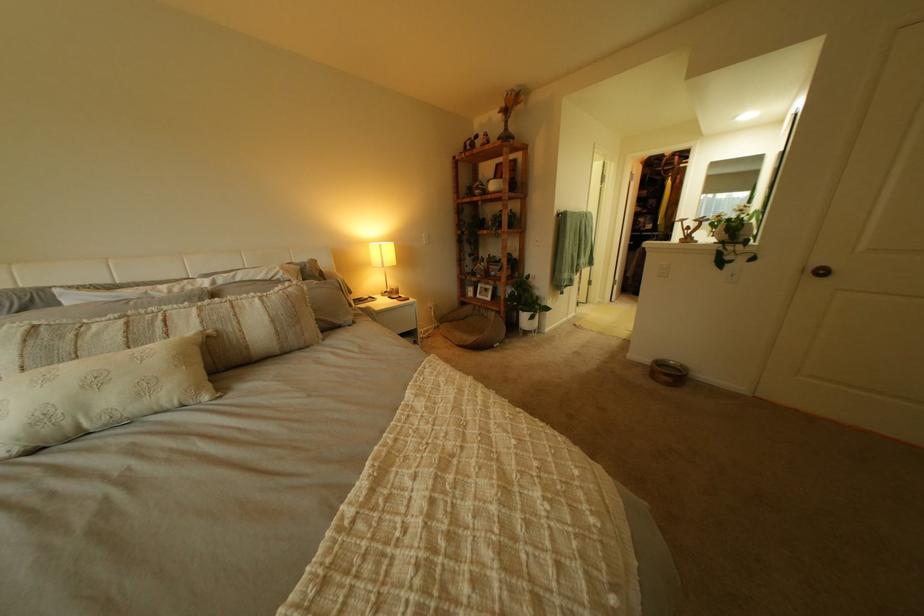
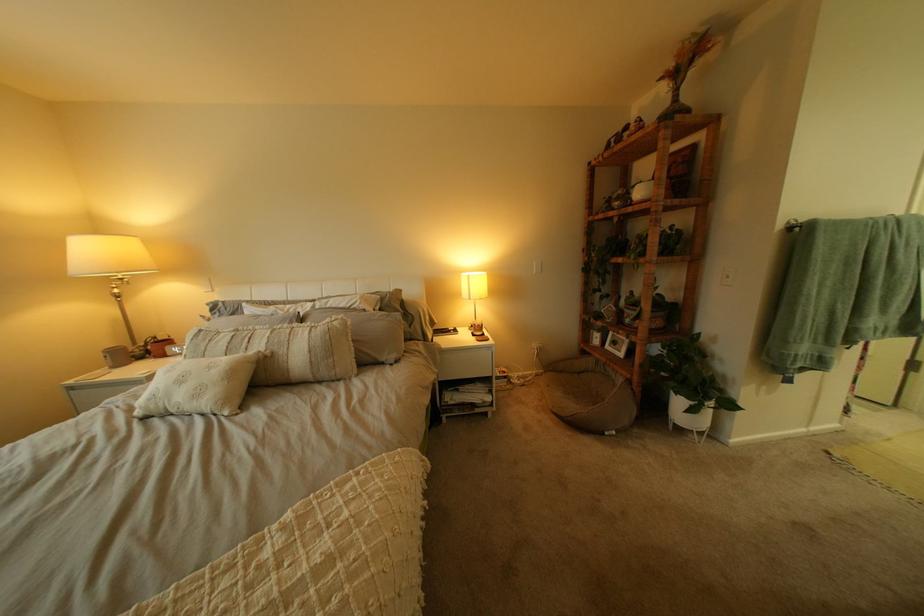
Where in the second image is the point corresponding to the point at 213,323 from the first image?

(281, 342)